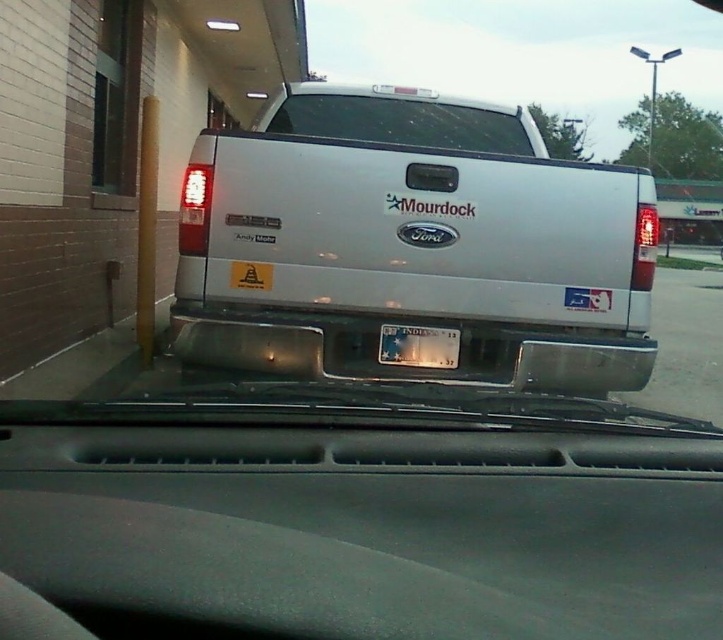
Between clear glass windshield at center and white plastic license plate at center, which one appears on the left side from the viewer's perspective?

white plastic license plate at center

Is clear glass windshield at center positioned behind white plastic license plate at center?

Yes, clear glass windshield at center is further from the viewer.

Which is behind, point (458, 113) or point (382, 358)?

Point (458, 113)

At what (x,y) coordinates should I click in order to perform the action: click on clear glass windshield at center. Please return your answer as a coordinate pair (x, y). Looking at the image, I should click on (406, 120).

Between silver metallic pickup truck at center and white plastic license plate at center, which one appears on the right side from the viewer's perspective?

Positioned to the right is silver metallic pickup truck at center.

In the scene shown: Does silver metallic pickup truck at center have a lesser width compared to white plastic license plate at center?

In fact, silver metallic pickup truck at center might be wider than white plastic license plate at center.

The width and height of the screenshot is (723, 640). Describe the element at coordinates (411, 244) in the screenshot. I see `silver metallic pickup truck at center` at that location.

Find the location of `silver metallic pickup truck at center`. silver metallic pickup truck at center is located at coordinates (411, 244).

Is silver metallic pickup truck at center below clear glass windshield at center?

Correct, silver metallic pickup truck at center is located below clear glass windshield at center.

Is point (502, 154) farther from viewer compared to point (474, 112)?

No, (502, 154) is closer to viewer.

Locate an element on the screen. The image size is (723, 640). silver metallic pickup truck at center is located at coordinates (411, 244).